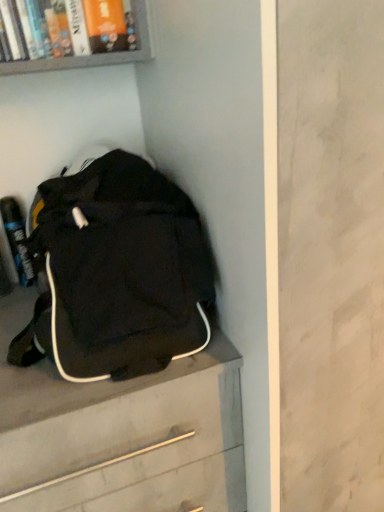
Question: Considering the positions of black fabric backpack at lower left and black fabric chest of drawers at lower left in the image, is black fabric backpack at lower left taller or shorter than black fabric chest of drawers at lower left?

Choices:
 (A) tall
 (B) short

Answer: (B)

Question: From the image's perspective, is black fabric backpack at lower left positioned above or below black fabric chest of drawers at lower left?

Choices:
 (A) below
 (B) above

Answer: (B)

Question: Visually, is black fabric backpack at lower left positioned to the left or to the right of black fabric chest of drawers at lower left?

Choices:
 (A) right
 (B) left

Answer: (A)

Question: From the image's perspective, is black fabric chest of drawers at lower left located above or below black fabric backpack at lower left?

Choices:
 (A) below
 (B) above

Answer: (A)

Question: Is black fabric chest of drawers at lower left inside the boundaries of black fabric backpack at lower left, or outside?

Choices:
 (A) outside
 (B) inside

Answer: (A)

Question: Is black fabric chest of drawers at lower left wider or thinner than black fabric backpack at lower left?

Choices:
 (A) thin
 (B) wide

Answer: (B)

Question: Considering their positions, is black fabric chest of drawers at lower left located in front of or behind black fabric backpack at lower left?

Choices:
 (A) behind
 (B) front

Answer: (A)